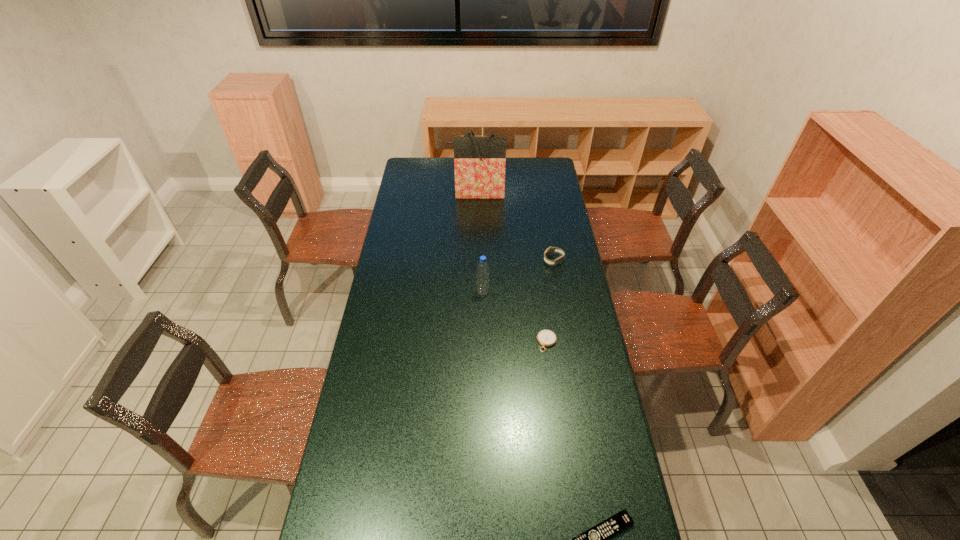
This screenshot has height=540, width=960. I want to click on vacant region located 0.070m on the face of the fourth nearest object, so click(x=528, y=261).

Identify the location of free space located on the face of the fourth nearest object. (533, 261).

Identify the location of vacant area situated 0.340m on the back of the fourth farthest object. (538, 273).

Identify the location of watch that is positioned at the right edge. (549, 251).

Where is `compass present at the right edge`? compass present at the right edge is located at coordinates (546, 338).

Where is `free space at the far edge`? This screenshot has height=540, width=960. free space at the far edge is located at coordinates [x=440, y=179].

Find the location of `free space at the left edge of the desktop`. free space at the left edge of the desktop is located at coordinates (365, 493).

In the image, there is a desktop. Identify the location of free space at the right edge. (561, 205).

Where is `free point between the farthest object and the compass`? free point between the farthest object and the compass is located at coordinates (512, 267).

At what (x,y) coordinates should I click in order to perform the action: click on free point between the fourth shortest object and the fourth farthest object. Please return your answer as a coordinate pair (x, y). Image resolution: width=960 pixels, height=540 pixels. Looking at the image, I should click on (515, 317).